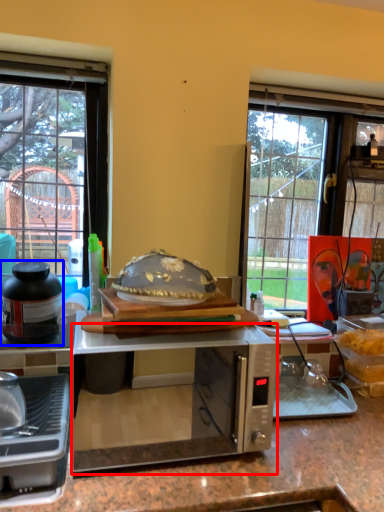
Question: Which object appears farthest to the camera in this image, microwave oven (highlighted by a red box) or kitchen appliance (highlighted by a blue box)?

Choices:
 (A) microwave oven
 (B) kitchen appliance

Answer: (B)